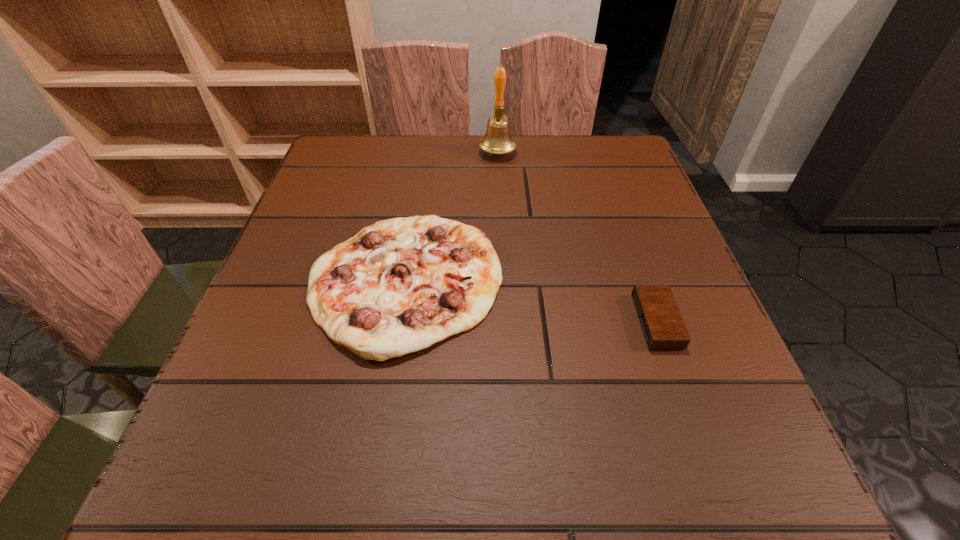
Find the location of `vacant area between the rightmost object and the pizza`. vacant area between the rightmost object and the pizza is located at coordinates (531, 302).

You are a GUI agent. You are given a task and a screenshot of the screen. Output one action in this format:
    pyautogui.click(x=<x>, y=<y>)
    Task: Click on the empty location between the pizza and the shortest object
    
    Given the screenshot: What is the action you would take?
    pyautogui.click(x=531, y=302)

You are a GUI agent. You are given a task and a screenshot of the screen. Output one action in this format:
    pyautogui.click(x=<x>, y=<y>)
    Task: Click on the vacant area between the farthest object and the alarm clock
    This screenshot has height=540, width=960.
    Given the screenshot: What is the action you would take?
    coord(577,237)

The width and height of the screenshot is (960, 540). I want to click on vacant region between the tallest object and the alarm clock, so click(577, 237).

Locate an element on the screen. free space between the tallest object and the second shortest object is located at coordinates (451, 218).

Find the location of a particular element. free space between the pizza and the shortest object is located at coordinates (531, 302).

The image size is (960, 540). What are the coordinates of `vacant space that's between the shortest object and the tallest object` in the screenshot? It's located at (577, 237).

Where is `free spot between the farthest object and the alarm clock`? This screenshot has width=960, height=540. free spot between the farthest object and the alarm clock is located at coordinates (577, 237).

The height and width of the screenshot is (540, 960). I want to click on blank region between the rightmost object and the tallest object, so click(x=577, y=237).

I want to click on empty space between the shortest object and the tallest object, so click(577, 237).